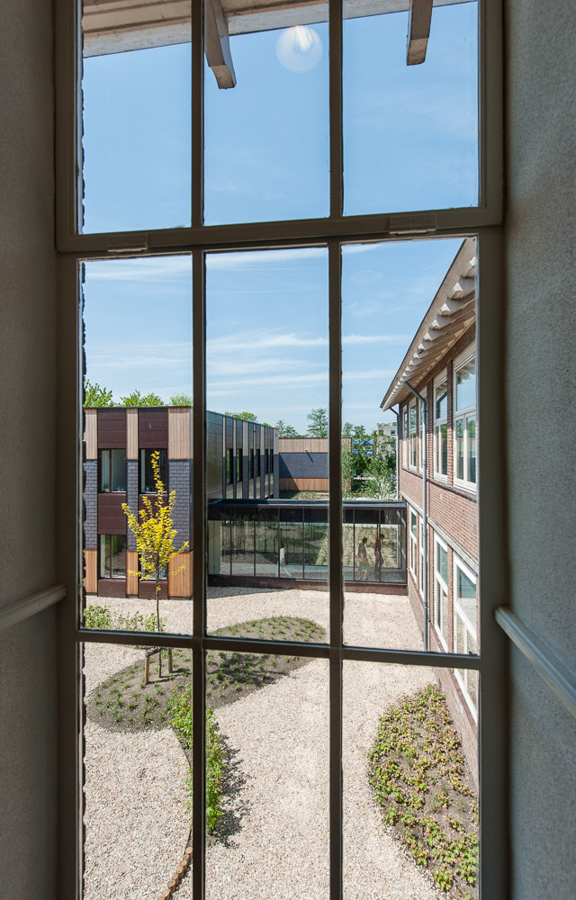
Find the location of a particular element. The image size is (576, 900). small plants is located at coordinates (135, 697), (121, 706), (109, 686).